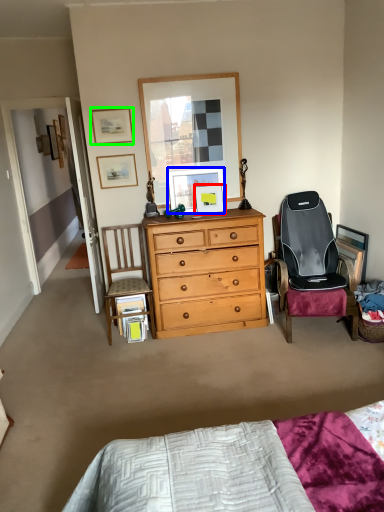
Question: Considering the real-world distances, which object is closest to picture frame (highlighted by a red box)? picture frame (highlighted by a blue box) or picture frame (highlighted by a green box).

Choices:
 (A) picture frame
 (B) picture frame

Answer: (A)